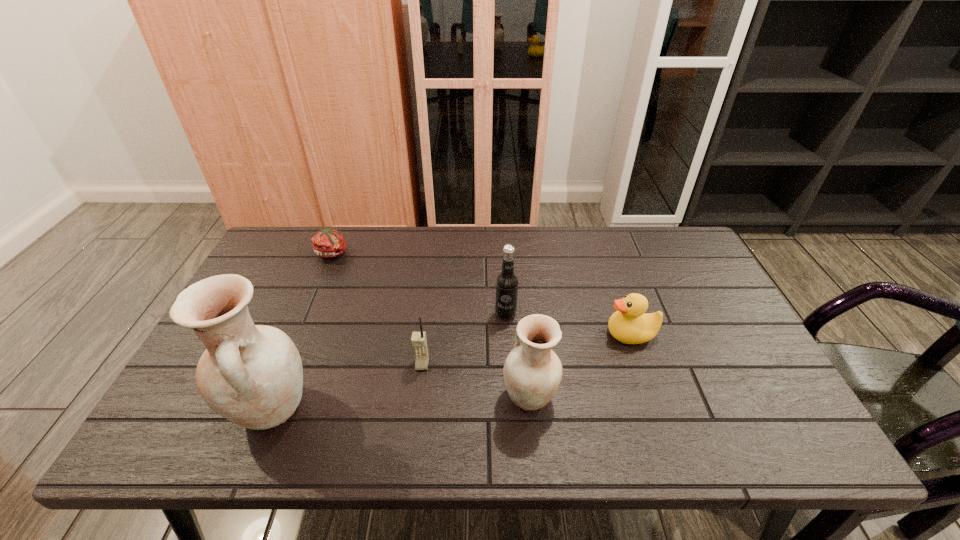
This screenshot has height=540, width=960. What are the coordinates of `vacant space located on the right of the taller pottery` in the screenshot? It's located at (477, 410).

Identify the location of blank space located on the right of the shorter pottery. (605, 396).

Locate an element on the screen. The image size is (960, 540). vacant space situated on the front of the shortest object is located at coordinates coord(294,350).

At what (x,y) coordinates should I click in order to perform the action: click on vacant space located at the beak of the fifth tallest object. Please return your answer as a coordinate pair (x, y). The height and width of the screenshot is (540, 960). Looking at the image, I should click on (531, 334).

The width and height of the screenshot is (960, 540). Find the location of `vacant space located 0.100m at the beak of the fifth tallest object`. vacant space located 0.100m at the beak of the fifth tallest object is located at coordinates (568, 334).

I want to click on free spot located 0.350m at the beak of the fifth tallest object, so [x=473, y=334].

You are a GUI agent. You are given a task and a screenshot of the screen. Output one action in this format:
    pyautogui.click(x=<x>, y=<y>)
    Task: Click on the vacant point located 0.090m on the front of the cellular telephone, where the keypad is located
    The width and height of the screenshot is (960, 540).
    Given the screenshot: What is the action you would take?
    pyautogui.click(x=418, y=403)

This screenshot has width=960, height=540. Find the location of `vacant space positioned 0.110m on the label of the root beer`. vacant space positioned 0.110m on the label of the root beer is located at coordinates (508, 354).

The height and width of the screenshot is (540, 960). I want to click on object at the far edge, so click(327, 243).

The height and width of the screenshot is (540, 960). I want to click on pottery at the left edge, so click(x=252, y=375).